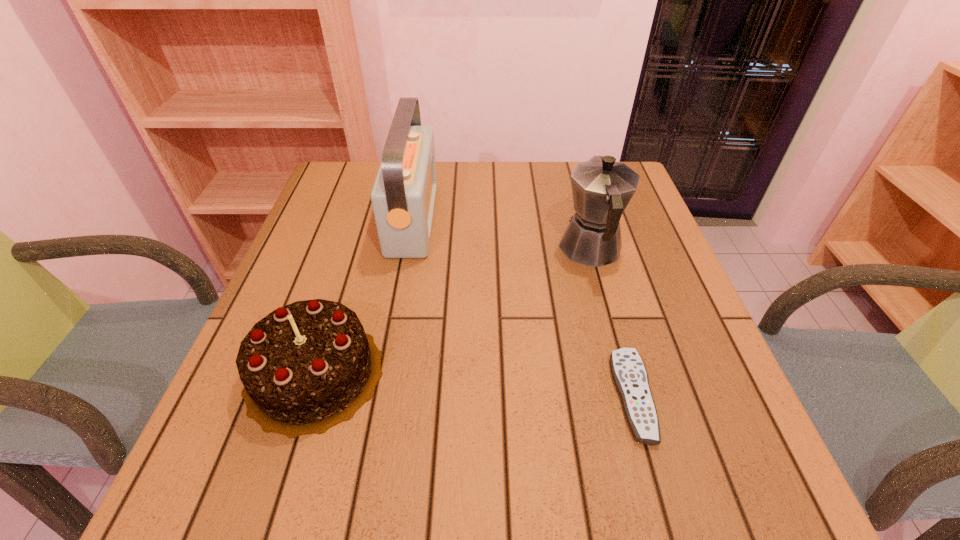
Locate an element on the screen. Image resolution: width=960 pixels, height=540 pixels. empty location between the radio receiver and the shortest object is located at coordinates (523, 307).

Where is `free space that is in between the coffeepot and the radio receiver`? The height and width of the screenshot is (540, 960). free space that is in between the coffeepot and the radio receiver is located at coordinates (502, 234).

Locate an element on the screen. free space between the coffeepot and the radio receiver is located at coordinates (502, 234).

The height and width of the screenshot is (540, 960). What are the coordinates of `free space between the third tallest object and the shortest object` in the screenshot? It's located at (474, 384).

Image resolution: width=960 pixels, height=540 pixels. What are the coordinates of `free point between the radio receiver and the coffeepot` in the screenshot? It's located at 502,234.

The image size is (960, 540). I want to click on empty space between the radio receiver and the third tallest object, so click(364, 296).

Identify the location of vacant area that lies between the radio receiver and the birthday cake. The height and width of the screenshot is (540, 960). (364, 296).

Locate an element on the screen. free space that is in between the radio receiver and the coffeepot is located at coordinates (502, 234).

You are a GUI agent. You are given a task and a screenshot of the screen. Output one action in this format:
    pyautogui.click(x=<x>, y=<y>)
    Task: Click on the vacant space in between the birthday cake and the radio receiver
    The image size is (960, 540).
    Given the screenshot: What is the action you would take?
    pyautogui.click(x=364, y=296)

Identify the location of object that is the closest one to the remote control. (601, 188).